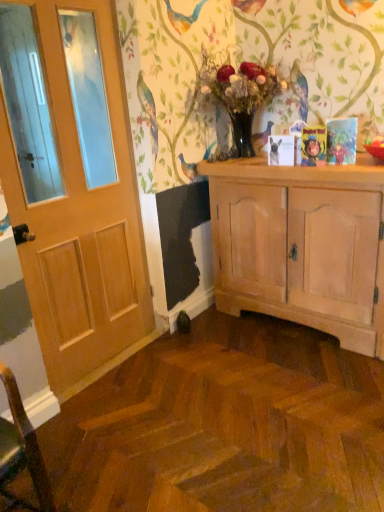
At what (x,y) coordinates should I click in order to perform the action: click on free spot in front of cartoon character book at upper right. Please return your answer as a coordinate pair (x, y). Image resolution: width=384 pixels, height=512 pixels. Looking at the image, I should click on (332, 170).